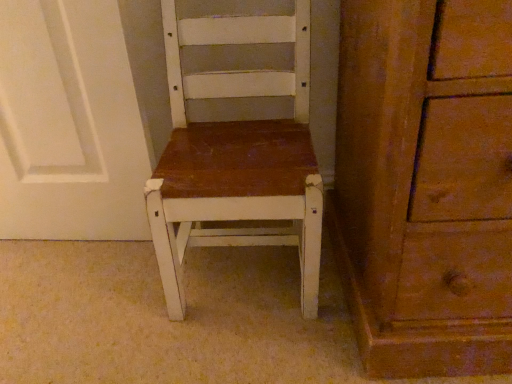
Locate an element on the screen. vacant area situated to the left side of matte white chair at center is located at coordinates (97, 293).